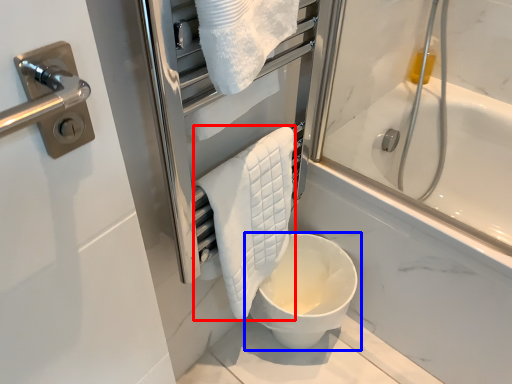
Question: Which object appears closest to the camera in this image, bath towel (highlighted by a red box) or toilet (highlighted by a blue box)?

Choices:
 (A) bath towel
 (B) toilet

Answer: (A)